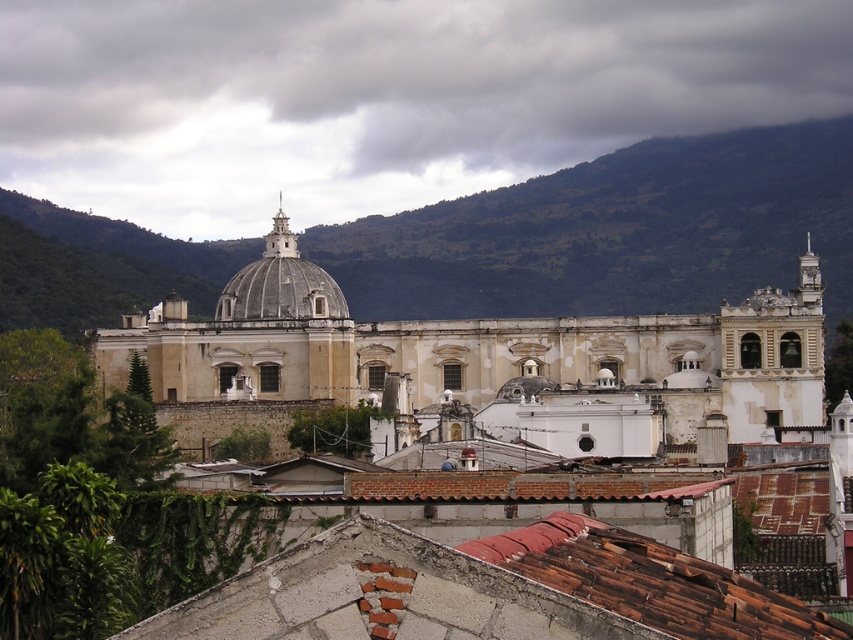
You are an architect analyzing the cityscape. From your vantage point, which structure would appear larger in the scene? The brown tile roof at center or the smooth gray dome at center?

The brown tile roof at center appears larger because it is closer to the viewer than the smooth gray dome at center.

You are an architect analyzing the cityscape. You notice the white stone church at center and the brown tile roof at center. Which structure is closer to your viewpoint?

The white stone church at center is closer to the viewer than the brown tile roof at center based on their spatial arrangement in the image.